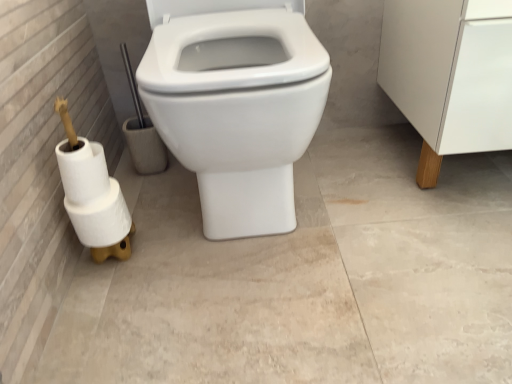
The height and width of the screenshot is (384, 512). Find the location of `free location in front of white glossy toilet at center`. free location in front of white glossy toilet at center is located at coordinates (261, 312).